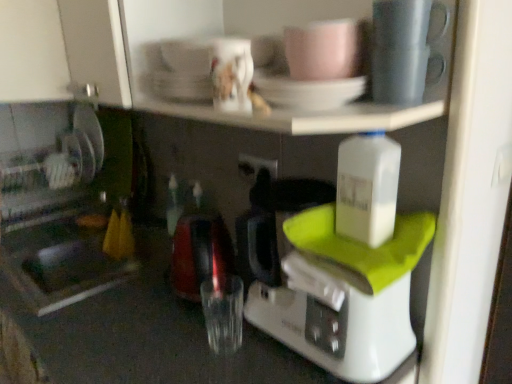
Question: Which direction should I rotate to look at pink matte mug at upper center, placed as the first coffee cup when sorted from right to left?

Choices:
 (A) left
 (B) right

Answer: (B)

Question: From the image's perspective, is matte ceramic mug at upper center, positioned as the second tableware in right-to-left order, located beneath white plastic coffee maker at center?

Choices:
 (A) yes
 (B) no

Answer: (B)

Question: Is white plastic coffee maker at center inside matte ceramic mug at upper center, the first tableware in the left-to-right sequence?

Choices:
 (A) no
 (B) yes

Answer: (A)

Question: Are matte ceramic mug at upper center, the first tableware in the left-to-right sequence, and white plastic coffee maker at center located far from each other?

Choices:
 (A) yes
 (B) no

Answer: (B)

Question: Is the surface of matte ceramic mug at upper center, the first tableware in the left-to-right sequence, in direct contact with white plastic coffee maker at center?

Choices:
 (A) yes
 (B) no

Answer: (B)

Question: Can you confirm if matte ceramic mug at upper center, the first tableware in the left-to-right sequence, is positioned to the right of white plastic coffee maker at center?

Choices:
 (A) yes
 (B) no

Answer: (B)

Question: Can you confirm if matte ceramic mug at upper center, the first tableware in the left-to-right sequence, is shorter than white plastic coffee maker at center?

Choices:
 (A) yes
 (B) no

Answer: (A)

Question: Does pink matte mug at upper center, positioned as the second coffee cup in left-to-right order, come behind porcelain white coffee cup at upper center, the 2th coffee cup positioned from the right?

Choices:
 (A) no
 (B) yes

Answer: (A)

Question: Is pink matte mug at upper center, placed as the first coffee cup when sorted from right to left, positioned far away from porcelain white coffee cup at upper center, the first coffee cup in the left-to-right sequence?

Choices:
 (A) yes
 (B) no

Answer: (B)

Question: Is pink matte mug at upper center, placed as the first coffee cup when sorted from right to left, at the right side of porcelain white coffee cup at upper center, the first coffee cup in the left-to-right sequence?

Choices:
 (A) yes
 (B) no

Answer: (A)

Question: Would you say pink matte mug at upper center, positioned as the second coffee cup in left-to-right order, is outside porcelain white coffee cup at upper center, the first coffee cup in the left-to-right sequence?

Choices:
 (A) yes
 (B) no

Answer: (A)

Question: Considering the relative sizes of pink matte mug at upper center, positioned as the second coffee cup in left-to-right order, and porcelain white coffee cup at upper center, the 2th coffee cup positioned from the right, in the image provided, is pink matte mug at upper center, positioned as the second coffee cup in left-to-right order, bigger than porcelain white coffee cup at upper center, the 2th coffee cup positioned from the right,?

Choices:
 (A) yes
 (B) no

Answer: (A)

Question: Does pink matte mug at upper center, positioned as the second coffee cup in left-to-right order, lie in front of porcelain white coffee cup at upper center, the 2th coffee cup positioned from the right?

Choices:
 (A) yes
 (B) no

Answer: (A)

Question: From a real-world perspective, is black plastic electric outlet at center positioned under white plastic bottle at center-right based on gravity?

Choices:
 (A) no
 (B) yes

Answer: (B)